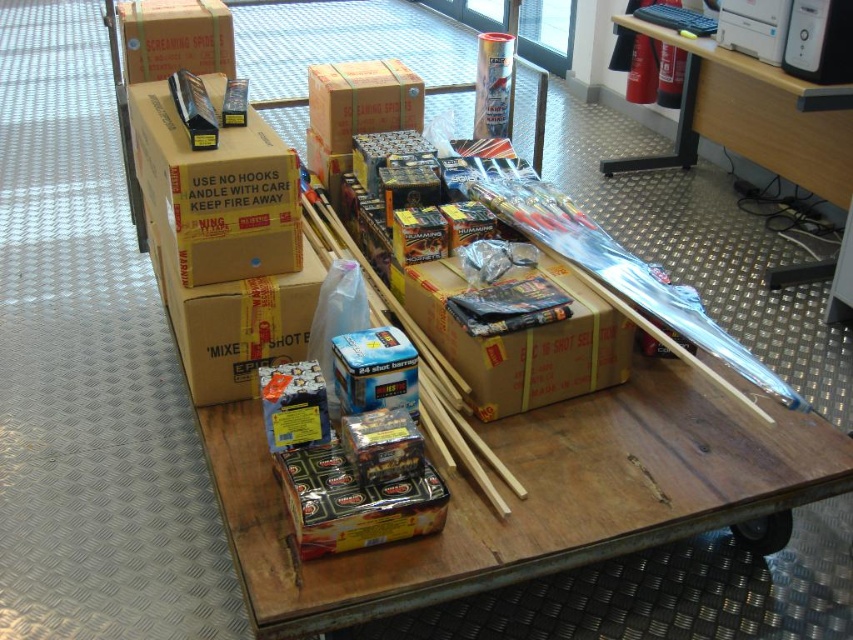
Question: Does brown cardboard box at upper left have a smaller size compared to matte cardboard box at upper left?

Choices:
 (A) yes
 (B) no

Answer: (B)

Question: Can you confirm if matte cardboard box at center is wider than matte cardboard box at upper left?

Choices:
 (A) yes
 (B) no

Answer: (A)

Question: Which object is positioned farthest from the brown cardboard box at upper left?

Choices:
 (A) matte cardboard box at upper left
 (B) matte cardboard box at center

Answer: (A)

Question: Which point appears closest to the camera in this image?

Choices:
 (A) (556, 269)
 (B) (299, 298)

Answer: (B)

Question: Does brown cardboard box at upper left have a larger size compared to brown cardboard box at center?

Choices:
 (A) no
 (B) yes

Answer: (B)

Question: Which of the following is the farthest from the observer?

Choices:
 (A) (230, 22)
 (B) (543, 400)
 (C) (202, 284)
 (D) (289, 278)

Answer: (A)